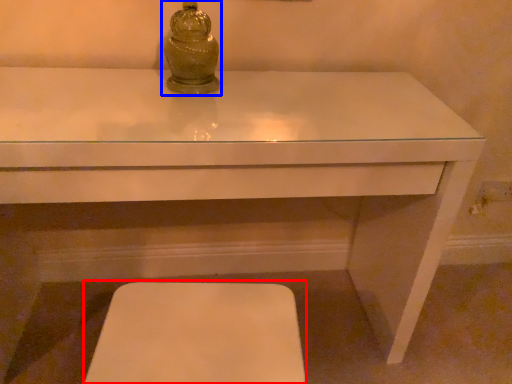
Question: Which object is further to the camera taking this photo, step stool (highlighted by a red box) or candle holder (highlighted by a blue box)?

Choices:
 (A) step stool
 (B) candle holder

Answer: (B)